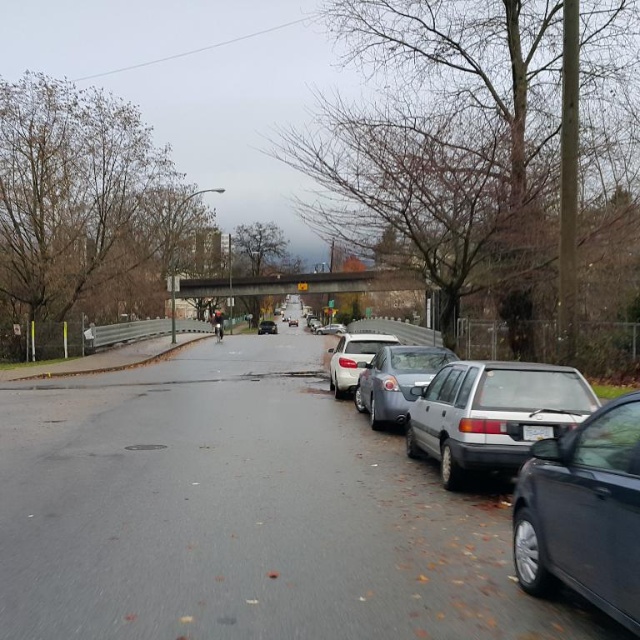
Can you confirm if concrete bridge at center is bigger than white plastic license plate at center?

Yes.

Between concrete bridge at center and white plastic license plate at center, which one has more height?

concrete bridge at center is taller.

Which is behind, point (225, 289) or point (531, 440)?

The point (225, 289) is more distant.

At what (x,y) coordinates should I click in order to perform the action: click on concrete bridge at center. Please return your answer as a coordinate pair (x, y). This screenshot has height=640, width=640. Looking at the image, I should click on (301, 284).

Which is behind, point (611, 496) or point (262, 321)?

The point (262, 321) is behind.

Does point (561, 538) lie behind point (272, 323)?

No, (561, 538) is in front of (272, 323).

Between point (525, 538) and point (262, 323), which one is positioned behind?

Positioned behind is point (262, 323).

Find the location of `shiny black sedan at right`. shiny black sedan at right is located at coordinates (582, 513).

Who is positioned more to the right, satin silver sedan at center or shiny silver sedan at center?

From the viewer's perspective, satin silver sedan at center appears more on the right side.

Between satin silver sedan at center and shiny silver sedan at center, which one has less height?

With less height is satin silver sedan at center.

Does point (388, 378) lie behind point (273, 332)?

No, (388, 378) is closer to viewer.

I want to click on satin silver sedan at center, so click(396, 380).